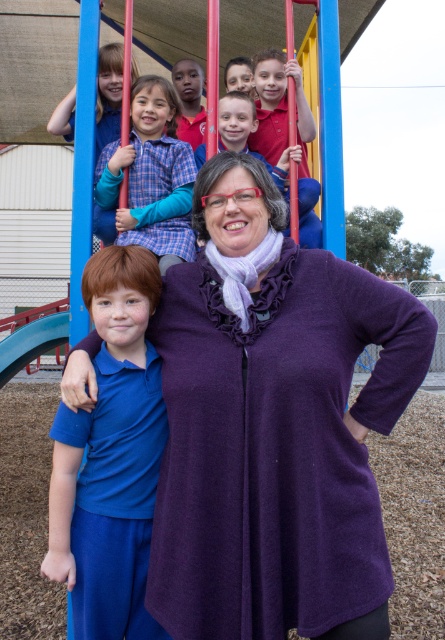
You are a photographer trying to capture the purple fleece sweater at center in your shot. Based on the coordinates provided, where should you position your camera to ensure the sweater is centered in the frame?

The purple fleece sweater at center is located at coordinates point (274,426), so positioning the camera to align the center of the frame with these coordinates will ensure the sweater is centered in the shot.

You are a photographer trying to capture a photo of the matte red shirt at upper center and the matte blue shirt at center. Which shirt should you focus on first if you want to capture both in one frame without moving the camera?

The matte red shirt at upper center is located below the matte blue shirt at center, so you should focus on the matte blue shirt at center first since it is higher up and will be in the frame naturally when capturing the lower one.